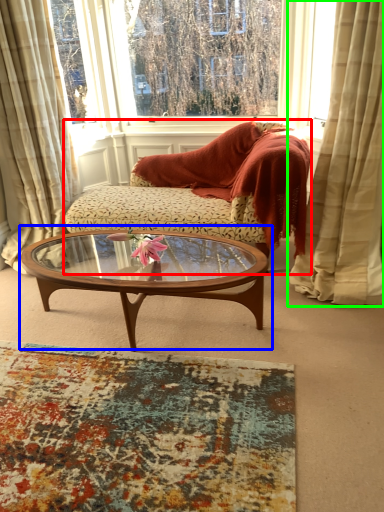
Question: Which object is the closest to the studio couch (highlighted by a red box)? Choose among these: coffee table (highlighted by a blue box) or curtain (highlighted by a green box).

Choices:
 (A) coffee table
 (B) curtain

Answer: (A)